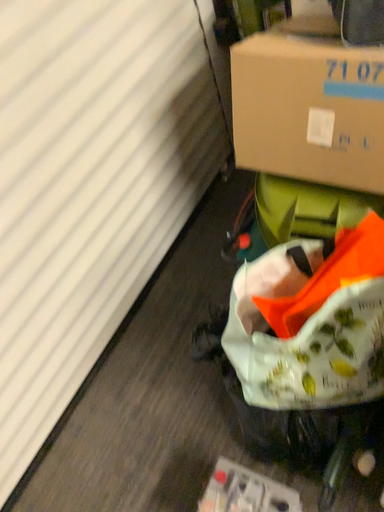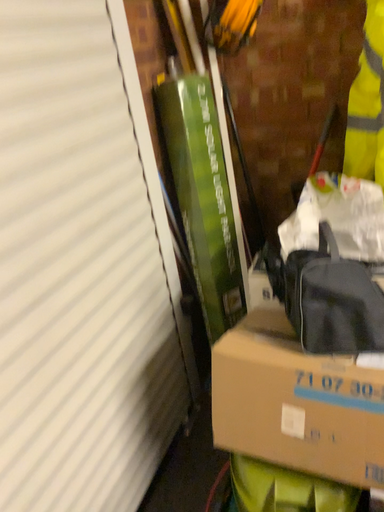
Question: How did the camera likely rotate when shooting the video?

Choices:
 (A) rotated left
 (B) rotated right

Answer: (B)